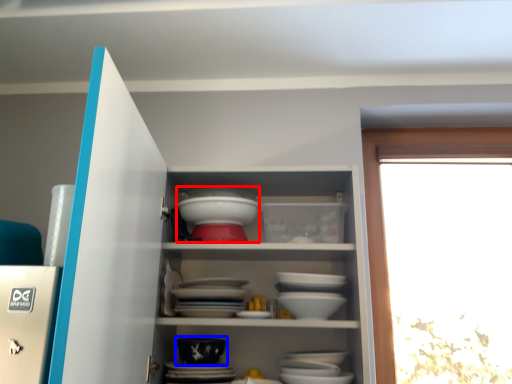
Question: Which of the following is the closest to the observer, tableware (highlighted by a red box) or bowl (highlighted by a blue box)?

Choices:
 (A) tableware
 (B) bowl

Answer: (B)